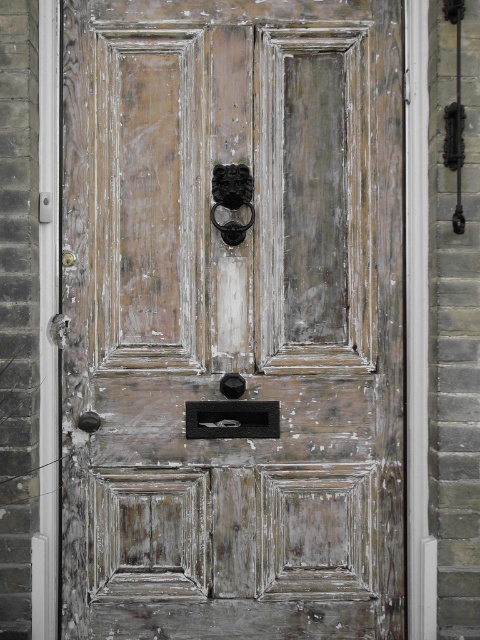
Question: Which of the following is the farthest from the observer?

Choices:
 (A) black textured knocker at center
 (B) distressed wood door at center

Answer: (B)

Question: Is distressed wood door at center wider than black textured knocker at center?

Choices:
 (A) yes
 (B) no

Answer: (A)

Question: Can you confirm if distressed wood door at center is wider than black textured knocker at center?

Choices:
 (A) yes
 (B) no

Answer: (A)

Question: Which point is closer to the camera taking this photo?

Choices:
 (A) (208, 237)
 (B) (228, 189)

Answer: (B)

Question: In this image, where is distressed wood door at center located relative to black textured knocker at center?

Choices:
 (A) left
 (B) right

Answer: (B)

Question: Among these points, which one is nearest to the camera?

Choices:
 (A) (222, 225)
 (B) (108, 29)

Answer: (A)